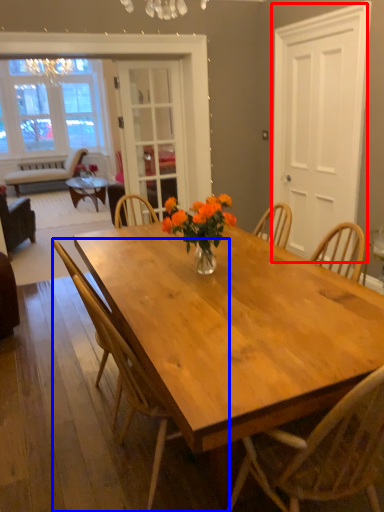
Question: Among these objects, which one is nearest to the camera, screen door (highlighted by a red box) or chair (highlighted by a blue box)?

Choices:
 (A) screen door
 (B) chair

Answer: (B)